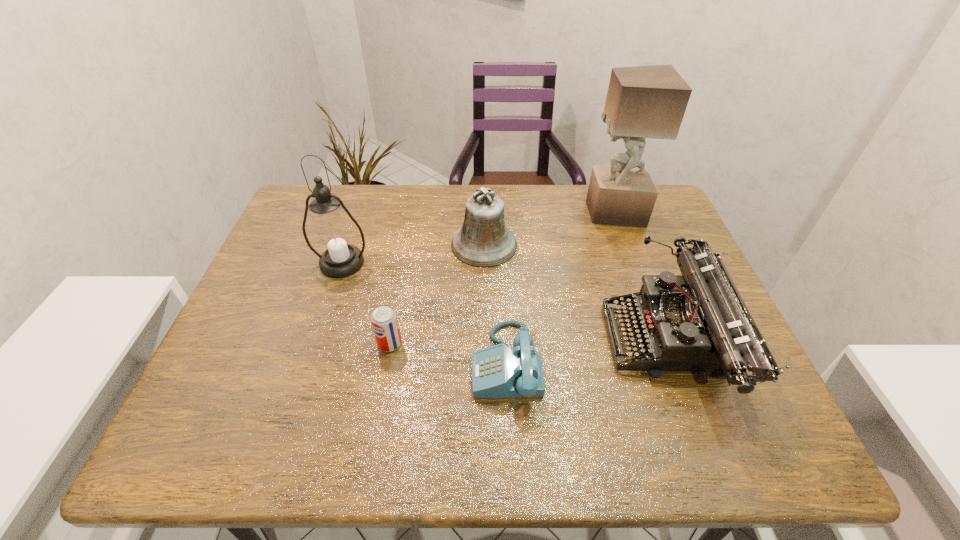
Where is `sculpture that is at the far edge`? The width and height of the screenshot is (960, 540). sculpture that is at the far edge is located at coordinates (642, 102).

At what (x,y) coordinates should I click in order to perform the action: click on bell that is positioned at the far edge. Please return your answer as a coordinate pair (x, y). The image size is (960, 540). Looking at the image, I should click on (483, 241).

This screenshot has width=960, height=540. Identify the location of object situated at the near edge. (697, 321).

Locate an element on the screen. The image size is (960, 540). object located in the left edge section of the desktop is located at coordinates (333, 235).

The height and width of the screenshot is (540, 960). I want to click on sculpture located at the right edge, so point(642,102).

Identify the location of typewriter located in the right edge section of the desktop. (697, 321).

Identify the location of object that is at the far right corner. (642, 102).

I want to click on object that is at the near right corner, so click(x=697, y=321).

At what (x,y) coordinates should I click in order to perform the action: click on blank space at the far edge of the desktop. Please return your answer as a coordinate pair (x, y). The height and width of the screenshot is (540, 960). Looking at the image, I should click on (418, 225).

The height and width of the screenshot is (540, 960). Identify the location of vacant region at the near edge. (406, 461).